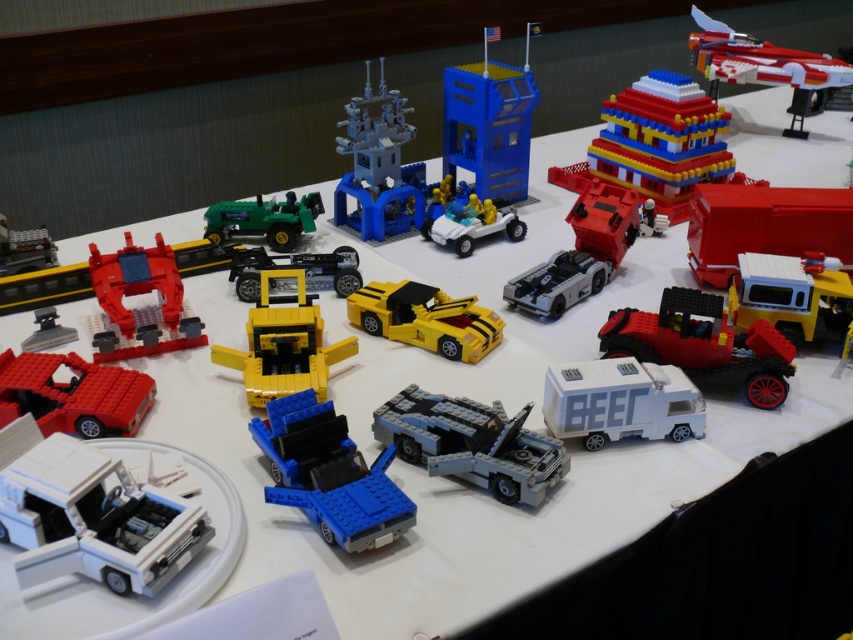
Question: Which point is closer to the camera?

Choices:
 (A) (109, 516)
 (B) (173, 296)
 (C) (820, 310)
 (D) (376, 100)

Answer: (A)

Question: Which point is closer to the camera?

Choices:
 (A) (809, 84)
 (B) (0, 369)
 (C) (230, 266)

Answer: (B)

Question: Which of the following is the farthest from the observer?

Choices:
 (A) (247, 259)
 (B) (637, 314)
 (C) (428, 296)

Answer: (A)

Question: From the image, what is the correct spatial relationship of yellow matte truck at center in relation to shiny red and white spaceship at upper right?

Choices:
 (A) right
 (B) left

Answer: (B)

Question: In this image, where is blue plastic building at center located relative to shiny red car at lower left?

Choices:
 (A) below
 (B) above

Answer: (B)

Question: Where is matte red truck at right located in relation to matte gray truck at left in the image?

Choices:
 (A) right
 (B) left

Answer: (A)